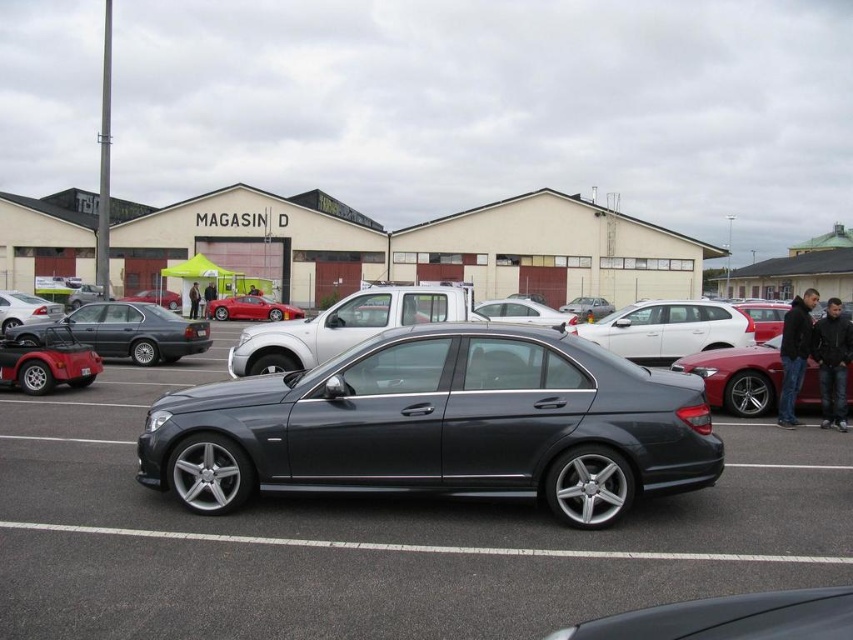
Question: Estimate the real-world distances between objects in this image. Which object is closer to the leather jacket at center?

Choices:
 (A) matte red convertible at lower left
 (B) metallic silver sedan at center
 (C) black leather jacket at right

Answer: (B)

Question: Which is farther from the satin black car at center?

Choices:
 (A) shiny red car at center
 (B) metallic silver sedan at left
 (C) dark gray leather jacket at lower right

Answer: (A)

Question: Can you confirm if satin metallic sedan at center is positioned below black leather jacket at right?

Choices:
 (A) no
 (B) yes

Answer: (B)

Question: Which point is farther from the camera taking this photo?

Choices:
 (A) (840, 420)
 (B) (602, 554)

Answer: (A)

Question: Can you confirm if dark gray leather jacket at lower right is positioned to the left of metallic silver sedan at left?

Choices:
 (A) yes
 (B) no

Answer: (B)

Question: Observing the image, what is the correct spatial positioning of satin metallic sedan at center in reference to dark gray leather jacket at lower right?

Choices:
 (A) above
 (B) below

Answer: (B)